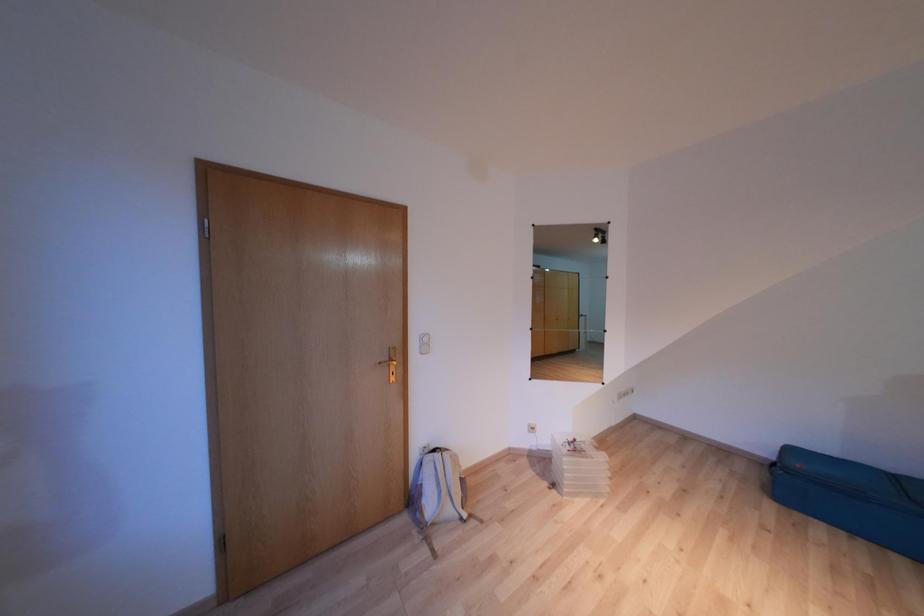
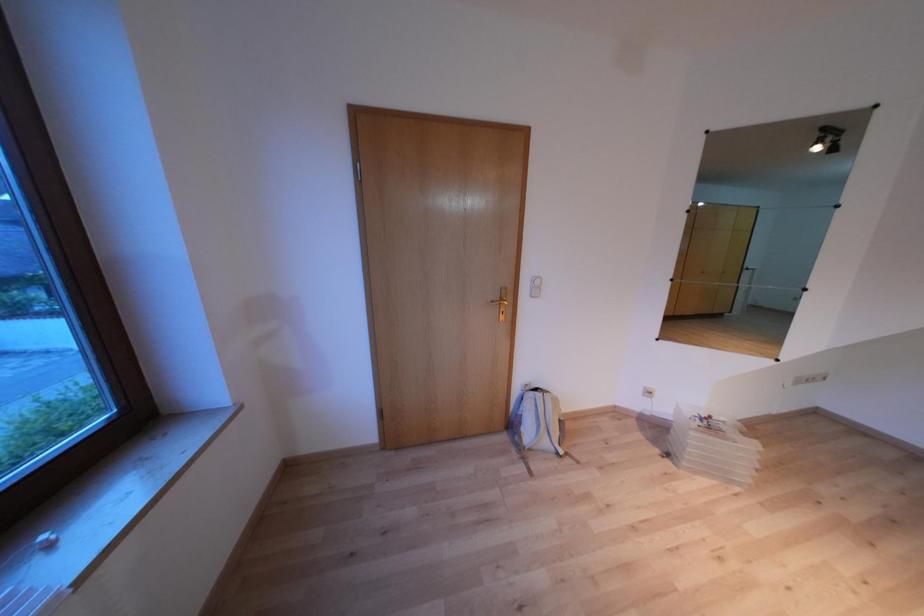
Question: The camera is either moving clockwise (left) or counter-clockwise (right) around the object. The first image is from the beginning of the video and the second image is from the end. Is the camera moving left or right when shooting the video?

Choices:
 (A) Left
 (B) Right

Answer: (B)